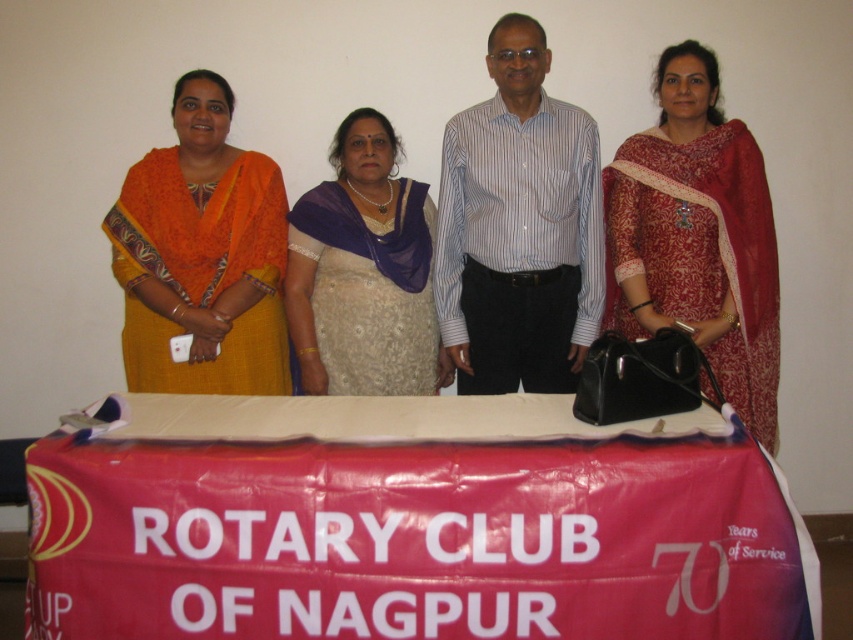
Is blue striped shirt at center to the right of beige embroidered saree at center from the viewer's perspective?

Indeed, blue striped shirt at center is positioned on the right side of beige embroidered saree at center.

Is blue striped shirt at center shorter than beige embroidered saree at center?

In fact, blue striped shirt at center may be taller than beige embroidered saree at center.

Where is `blue striped shirt at center`? The width and height of the screenshot is (853, 640). blue striped shirt at center is located at coordinates (518, 227).

Identify the location of blue striped shirt at center. (518, 227).

Between matte red saree at right and orange fabric saree at left, which one is positioned higher?

orange fabric saree at left is above.

Can you confirm if matte red saree at right is thinner than orange fabric saree at left?

Correct, matte red saree at right's width is less than orange fabric saree at left's.

You are a GUI agent. You are given a task and a screenshot of the screen. Output one action in this format:
    pyautogui.click(x=<x>, y=<y>)
    Task: Click on the matte red saree at right
    This screenshot has height=640, width=853.
    Given the screenshot: What is the action you would take?
    pyautogui.click(x=697, y=236)

You are a GUI agent. You are given a task and a screenshot of the screen. Output one action in this format:
    pyautogui.click(x=<x>, y=<y>)
    Task: Click on the matte red saree at right
    The image size is (853, 640).
    Given the screenshot: What is the action you would take?
    pyautogui.click(x=697, y=236)

Does orange fabric saree at left appear under beige embroidered saree at center?

Actually, orange fabric saree at left is above beige embroidered saree at center.

Which is in front, point (276, 285) or point (310, 200)?

Point (276, 285) is more forward.

This screenshot has width=853, height=640. I want to click on orange fabric saree at left, so click(x=202, y=256).